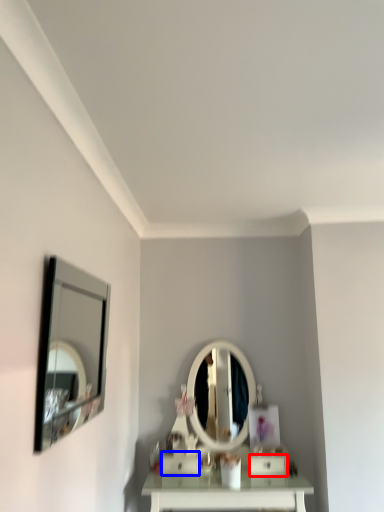
Question: Which object appears farthest to the camera in this image, drawer (highlighted by a red box) or drawer (highlighted by a blue box)?

Choices:
 (A) drawer
 (B) drawer

Answer: (B)